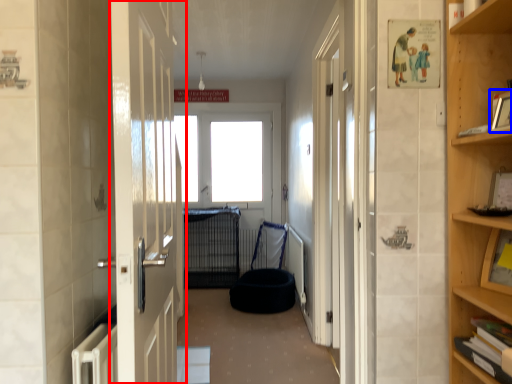
Question: Which of the following is the farthest to the observer, door (highlighted by a red box) or picture frame (highlighted by a blue box)?

Choices:
 (A) door
 (B) picture frame

Answer: (B)